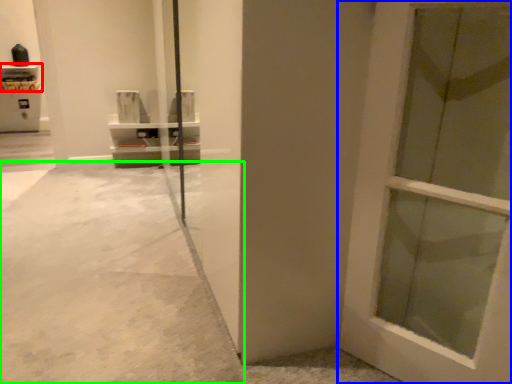
Question: Which object is positioned closest to shelf (highlighted by a red box)? Select from door (highlighted by a blue box) and concrete (highlighted by a green box).

Choices:
 (A) door
 (B) concrete

Answer: (B)